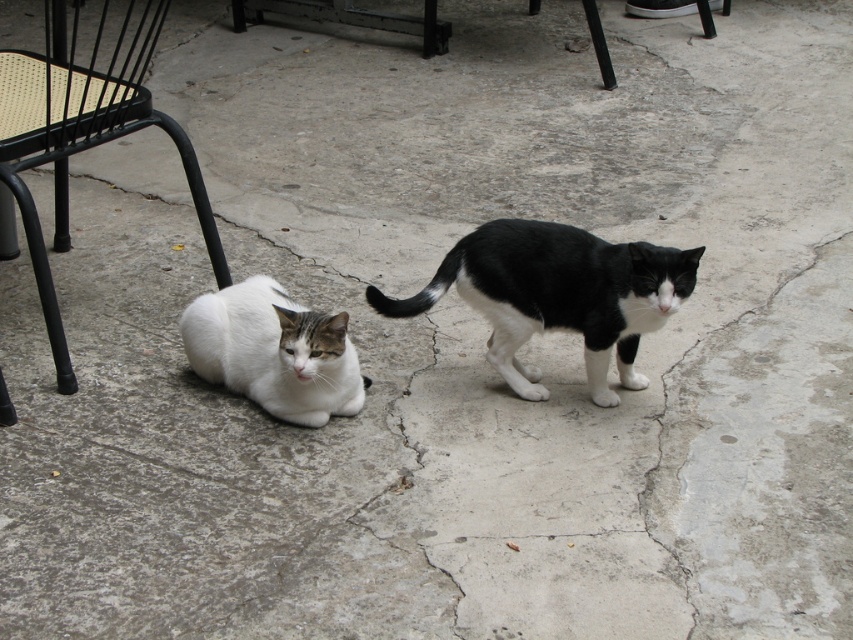
From the picture: Who is taller, black/white fur cat at center or white fur cat at lower left?

With more height is black/white fur cat at center.

Between black/white fur cat at center and white fur cat at lower left, which one has less height?

white fur cat at lower left

Is point (483, 246) positioned in front of point (201, 346)?

That is True.

I want to click on black/white fur cat at center, so click(x=556, y=296).

Image resolution: width=853 pixels, height=640 pixels. I want to click on black/white fur cat at center, so click(x=556, y=296).

Can you confirm if black/white fur cat at center is positioned to the left of black metal chair at left?

No, black/white fur cat at center is not to the left of black metal chair at left.

Between point (474, 273) and point (202, 218), which one is positioned behind?

Positioned behind is point (202, 218).

I want to click on black/white fur cat at center, so click(556, 296).

Can you confirm if black metal chair at left is wider than white fur cat at lower left?

Yes.

Between black metal chair at left and white fur cat at lower left, which one appears on the right side from the viewer's perspective?

white fur cat at lower left is more to the right.

Which is behind, point (96, 61) or point (247, 392)?

Positioned behind is point (96, 61).

At what (x,y) coordinates should I click in order to perform the action: click on black metal chair at left. Please return your answer as a coordinate pair (x, y). The width and height of the screenshot is (853, 640). Looking at the image, I should click on (83, 129).